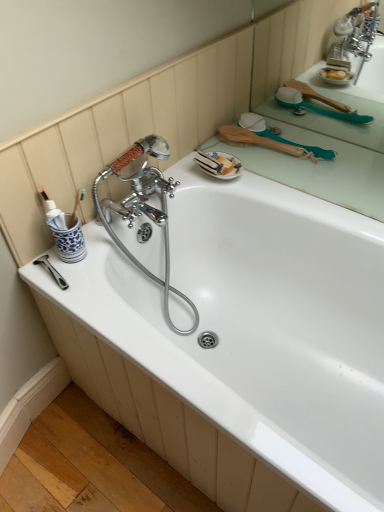
The height and width of the screenshot is (512, 384). Find the location of `white glossy bathtub at center`. white glossy bathtub at center is located at coordinates (248, 330).

Measure the distance between point (246, 444) and camera.

Point (246, 444) and camera are 29.13 inches apart from each other.

Image resolution: width=384 pixels, height=512 pixels. Describe the element at coordinates (248, 330) in the screenshot. I see `white glossy bathtub at center` at that location.

At what (x,y) coordinates should I click in order to perform the action: click on white glossy bathtub at center. Please return your answer as a coordinate pair (x, y). Image resolution: width=384 pixels, height=512 pixels. Looking at the image, I should click on (248, 330).